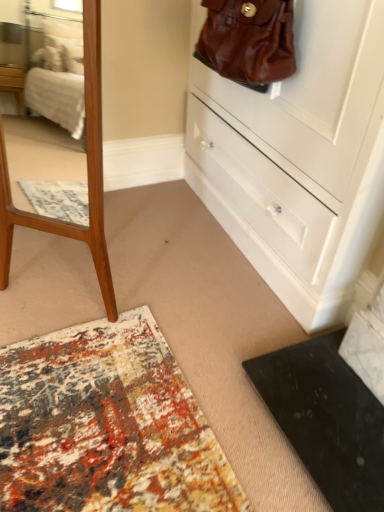
Question: Can you confirm if brown leather handbag at upper right is thinner than white glossy chest of drawers at upper right?

Choices:
 (A) yes
 (B) no

Answer: (A)

Question: From the image's perspective, is brown leather handbag at upper right located above white glossy chest of drawers at upper right?

Choices:
 (A) yes
 (B) no

Answer: (A)

Question: Can you confirm if brown leather handbag at upper right is bigger than white glossy chest of drawers at upper right?

Choices:
 (A) no
 (B) yes

Answer: (A)

Question: Is brown leather handbag at upper right outside white glossy chest of drawers at upper right?

Choices:
 (A) no
 (B) yes

Answer: (A)

Question: Does brown leather handbag at upper right have a greater width compared to white glossy chest of drawers at upper right?

Choices:
 (A) no
 (B) yes

Answer: (A)

Question: From the image's perspective, is brown leather handbag at upper right located beneath white glossy chest of drawers at upper right?

Choices:
 (A) yes
 (B) no

Answer: (B)

Question: Considering the relative sizes of white glossy chest of drawers at upper right and brown leather handbag at upper right in the image provided, is white glossy chest of drawers at upper right wider than brown leather handbag at upper right?

Choices:
 (A) no
 (B) yes

Answer: (B)

Question: Does white glossy chest of drawers at upper right turn towards brown leather handbag at upper right?

Choices:
 (A) yes
 (B) no

Answer: (A)

Question: Is white glossy chest of drawers at upper right closer to camera compared to brown leather handbag at upper right?

Choices:
 (A) no
 (B) yes

Answer: (B)

Question: Is white glossy chest of drawers at upper right smaller than brown leather handbag at upper right?

Choices:
 (A) no
 (B) yes

Answer: (A)

Question: From the image's perspective, is white glossy chest of drawers at upper right under brown leather handbag at upper right?

Choices:
 (A) yes
 (B) no

Answer: (A)

Question: Is white glossy chest of drawers at upper right outside brown leather handbag at upper right?

Choices:
 (A) no
 (B) yes

Answer: (B)

Question: Considering the positions of brown leather handbag at upper right and white glossy chest of drawers at upper right in the image, is brown leather handbag at upper right taller or shorter than white glossy chest of drawers at upper right?

Choices:
 (A) tall
 (B) short

Answer: (B)